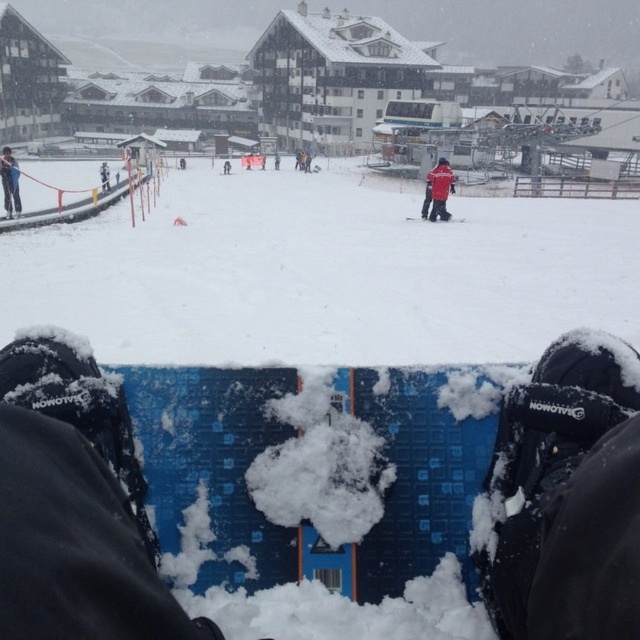
How much distance is there between white fluffy snow at center and blue textured snowboard at center?

They are 79.40 feet apart.

You are a GUI agent. You are given a task and a screenshot of the screen. Output one action in this format:
    pyautogui.click(x=<x>, y=<y>)
    Task: Click on the white fluffy snow at center
    The height and width of the screenshot is (640, 640).
    Given the screenshot: What is the action you would take?
    pyautogui.click(x=324, y=275)

Identify the location of white fluffy snow at center. (324, 275).

Which is below, red matte jacket at center or white snowboard at center?

red matte jacket at center is below.

Is red matte jacket at center further to camera compared to white snowboard at center?

No.

Find the location of a particular element. red matte jacket at center is located at coordinates (440, 189).

Consider the image. Which of these two, blue textured snowboard at center or white snowboard at center, stands shorter?

With less height is blue textured snowboard at center.

Who is more distant from viewer, (116, 572) or (106, 176)?

The point (106, 176) is behind.

Who is more distant from viewer, [586,605] or [100,166]?

Point [100,166]

In order to click on blue textured snowboard at center in this screenshot , I will do `click(74, 506)`.